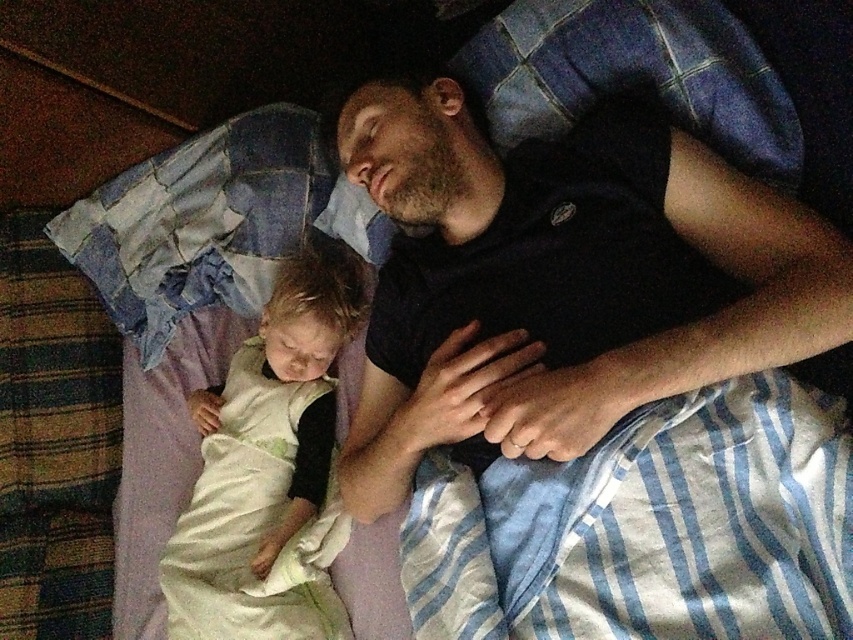
Based on the photo, between black matte shirt at upper right and soft white blanket at lower left, which one is positioned lower?

Positioned lower is soft white blanket at lower left.

Can you confirm if black matte shirt at upper right is positioned above soft white blanket at lower left?

Indeed, black matte shirt at upper right is positioned over soft white blanket at lower left.

What do you see at coordinates (561, 282) in the screenshot? This screenshot has width=853, height=640. I see `black matte shirt at upper right` at bounding box center [561, 282].

Image resolution: width=853 pixels, height=640 pixels. I want to click on black matte shirt at upper right, so click(561, 282).